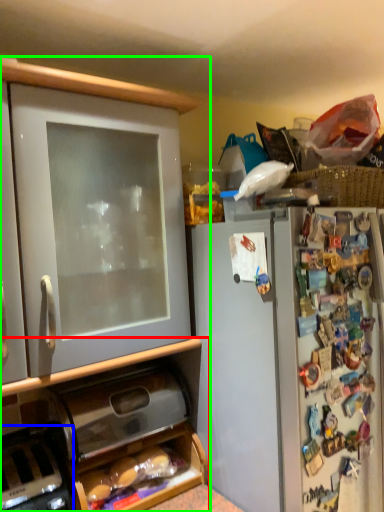
Question: Which object is the farthest from cabinetry (highlighted by a red box)? Choose among these: appliance (highlighted by a blue box) or cabinetry (highlighted by a green box).

Choices:
 (A) appliance
 (B) cabinetry

Answer: (A)